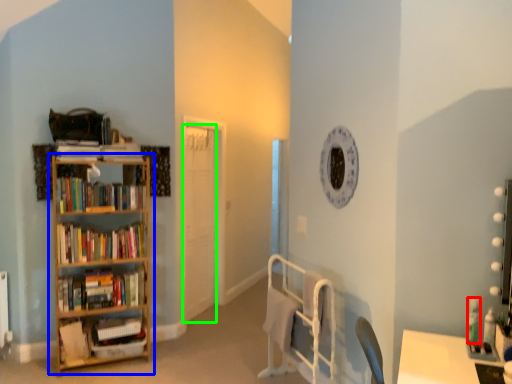
Question: Based on their relative distances, which object is nearer to toiletry (highlighted by a red box)? Choose from shelf (highlighted by a blue box) and door (highlighted by a green box).

Choices:
 (A) shelf
 (B) door

Answer: (A)